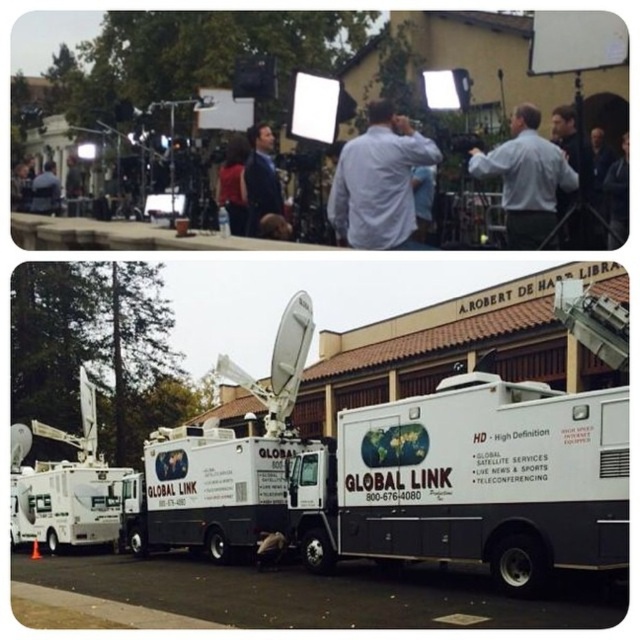
Does white shirt at center have a greater width compared to dark blue suit at center?

Yes, white shirt at center is wider than dark blue suit at center.

Which is behind, point (378, 120) or point (256, 220)?

The point (256, 220) is more distant.

You are a GUI agent. You are given a task and a screenshot of the screen. Output one action in this format:
    pyautogui.click(x=<x>, y=<y>)
    Task: Click on the white shirt at center
    
    Given the screenshot: What is the action you would take?
    pyautogui.click(x=378, y=182)

How distant is white shirt at center from matte red shirt at center?

white shirt at center and matte red shirt at center are 48.39 feet apart.

Between white shirt at center and matte red shirt at center, which one appears on the right side from the viewer's perspective?

white shirt at center

You are a GUI agent. You are given a task and a screenshot of the screen. Output one action in this format:
    pyautogui.click(x=<x>, y=<y>)
    Task: Click on the white shirt at center
    Image resolution: width=640 pixels, height=640 pixels.
    Given the screenshot: What is the action you would take?
    pyautogui.click(x=378, y=182)

Identify the location of white shirt at center. (378, 182).

Describe the element at coordinates (378, 182) in the screenshot. The image size is (640, 640). I see `white shirt at center` at that location.

Does point (326, 211) come in front of point (54, 177)?

That is True.

The width and height of the screenshot is (640, 640). In order to click on white shirt at center in this screenshot , I will do `click(378, 182)`.